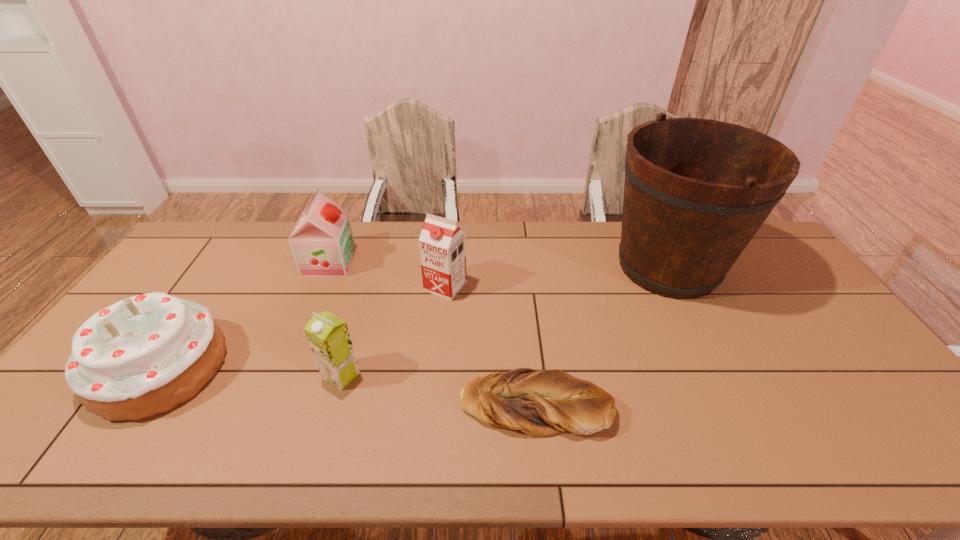
The height and width of the screenshot is (540, 960). Identify the location of free location located with the cap open on the second object from left to right. (398, 262).

Image resolution: width=960 pixels, height=540 pixels. I want to click on vacant space located on the right of the cake, so click(x=310, y=368).

The image size is (960, 540). Find the location of `vacant area situated 0.390m on the left of the third object from left to right`. vacant area situated 0.390m on the left of the third object from left to right is located at coordinates (173, 375).

Where is `vacant space located 0.140m on the right of the shortest object`? vacant space located 0.140m on the right of the shortest object is located at coordinates (668, 404).

The height and width of the screenshot is (540, 960). Identify the location of bucket present at the far edge. (696, 191).

Find the location of a particular element. soya milk at the far edge is located at coordinates (322, 243).

The width and height of the screenshot is (960, 540). Identify the location of object located in the near edge section of the desktop. click(539, 403).

At what (x,y) coordinates should I click in order to perform the action: click on object that is at the left edge. Please return your answer as a coordinate pair (x, y). The height and width of the screenshot is (540, 960). Looking at the image, I should click on (145, 355).

The width and height of the screenshot is (960, 540). I want to click on vacant space at the far edge, so click(470, 221).

In the image, there is a desktop. Where is `free space at the near edge`? free space at the near edge is located at coordinates (122, 445).